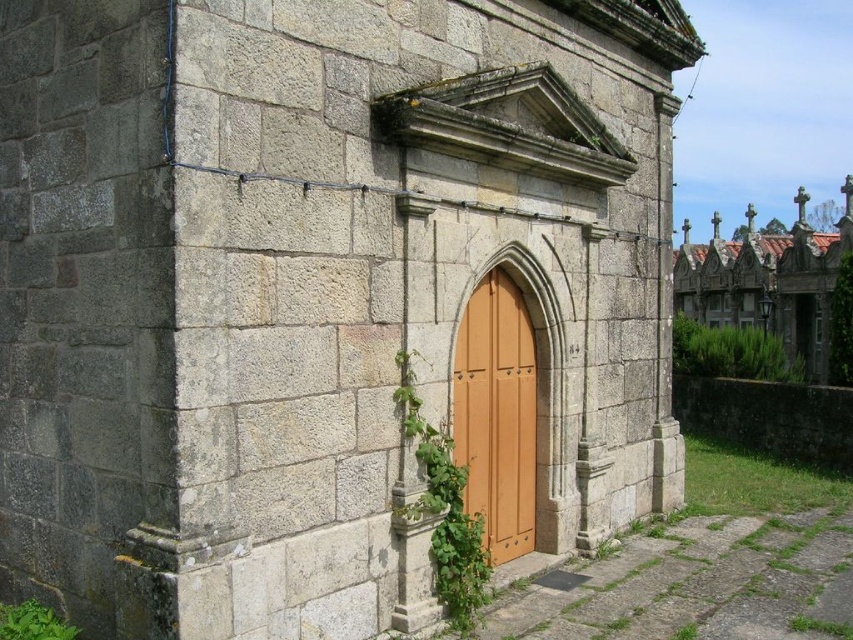
Does smooth gray stone church at upper right have a greater height compared to green leafy ivy at center?

Correct, smooth gray stone church at upper right is much taller as green leafy ivy at center.

Locate an element on the screen. The width and height of the screenshot is (853, 640). smooth gray stone church at upper right is located at coordinates (767, 280).

This screenshot has width=853, height=640. What are the coordinates of `smooth gray stone church at upper right` in the screenshot? It's located at pos(767,280).

Does wooden at center have a lesser height compared to smooth gray stone church at upper right?

Yes.

Is wooden at center closer to the viewer compared to smooth gray stone church at upper right?

Yes, wooden at center is in front of smooth gray stone church at upper right.

You are a GUI agent. You are given a task and a screenshot of the screen. Output one action in this format:
    pyautogui.click(x=<x>, y=<y>)
    Task: Click on the wooden at center
    The height and width of the screenshot is (640, 853).
    Given the screenshot: What is the action you would take?
    pyautogui.click(x=497, y=413)

Find the location of `wooden at center`. wooden at center is located at coordinates (497, 413).

Is wooden at center behind green leafy ivy at center?

Yes.

Where is `wooden at center`? wooden at center is located at coordinates (497, 413).